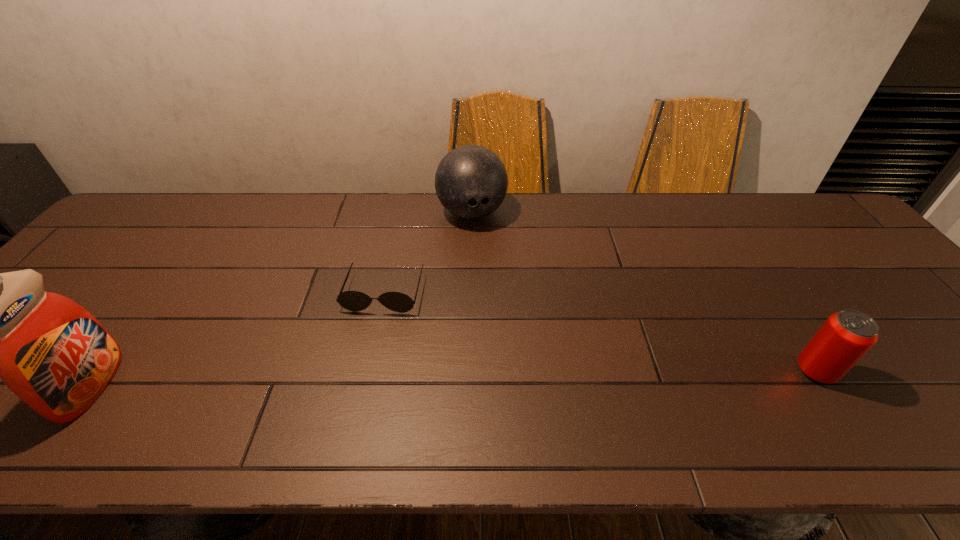
Where is `free space between the detergent and the third nearest object`? The height and width of the screenshot is (540, 960). free space between the detergent and the third nearest object is located at coordinates (238, 339).

Image resolution: width=960 pixels, height=540 pixels. I want to click on empty space that is in between the shortest object and the detergent, so click(238, 339).

At what (x,y) coordinates should I click in order to perform the action: click on vacant area that lies between the detergent and the third object from left to right. Please return your answer as a coordinate pair (x, y). The height and width of the screenshot is (540, 960). Looking at the image, I should click on (282, 299).

This screenshot has height=540, width=960. In order to click on vacant area that lies between the rightmost object and the leftmost object in this screenshot , I will do `click(453, 378)`.

Choose which object is the third nearest neighbor to the second tallest object. Please provide its 2D coordinates. Your answer should be formatted as a tuple, i.e. [(x, y)], where the tuple contains the x and y coordinates of a point satisfying the conditions above.

[(52, 353)]

Identify which object is located as the second nearest to the second farthest object. Please provide its 2D coordinates. Your answer should be formatted as a tuple, i.e. [(x, y)], where the tuple contains the x and y coordinates of a point satisfying the conditions above.

[(52, 353)]

You are a GUI agent. You are given a task and a screenshot of the screen. Output one action in this format:
    pyautogui.click(x=<x>, y=<y>)
    Task: Click on the vacant region that satisfies the following two spatial constraints: 1. on the front side of the shortest object; 2. on the left side of the rightmost object
    The width and height of the screenshot is (960, 540).
    Given the screenshot: What is the action you would take?
    pyautogui.click(x=367, y=371)

The width and height of the screenshot is (960, 540). I want to click on vacant space that satisfies the following two spatial constraints: 1. on the front side of the rightmost object; 2. on the left side of the third nearest object, so click(x=367, y=371).